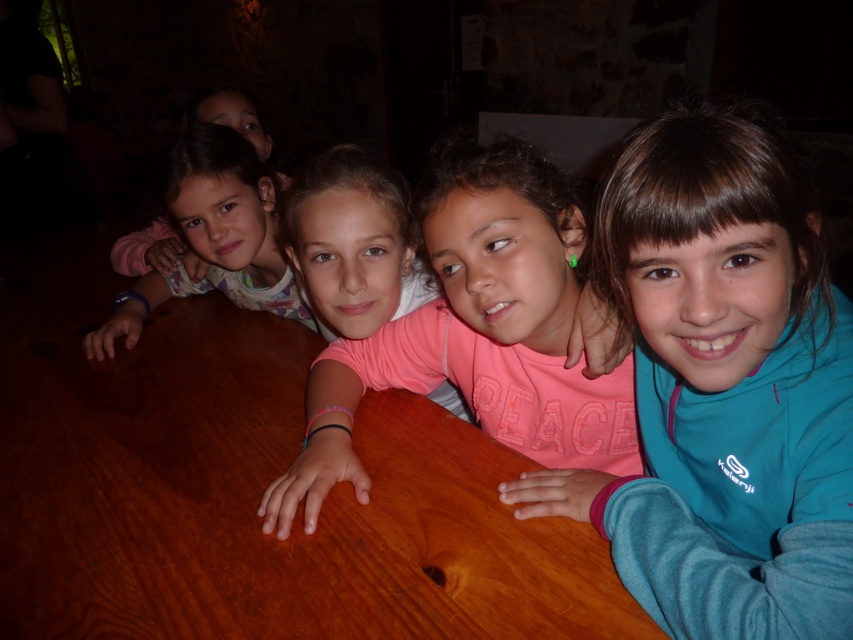
You are standing in the room and see the wooden table at center and the matte pink shirt at upper left. Which object is positioned to the left side of the other?

The wooden table at center is to the left of the matte pink shirt at upper left.

You are a parent trying to decide if your child can sit comfortably at the wooden table at center while wearing the teal fleece jacket at center. Based on the height of the table and jacket, is there enough space for the child to sit without the jacket hitting the table?

The wooden table at center is not as tall as the teal fleece jacket at center, meaning the jacket is taller than the table. This suggests that if the child is wearing the teal fleece jacket at center, the jacket might hit the table when sitting, so there may not be enough space for comfortable seating.